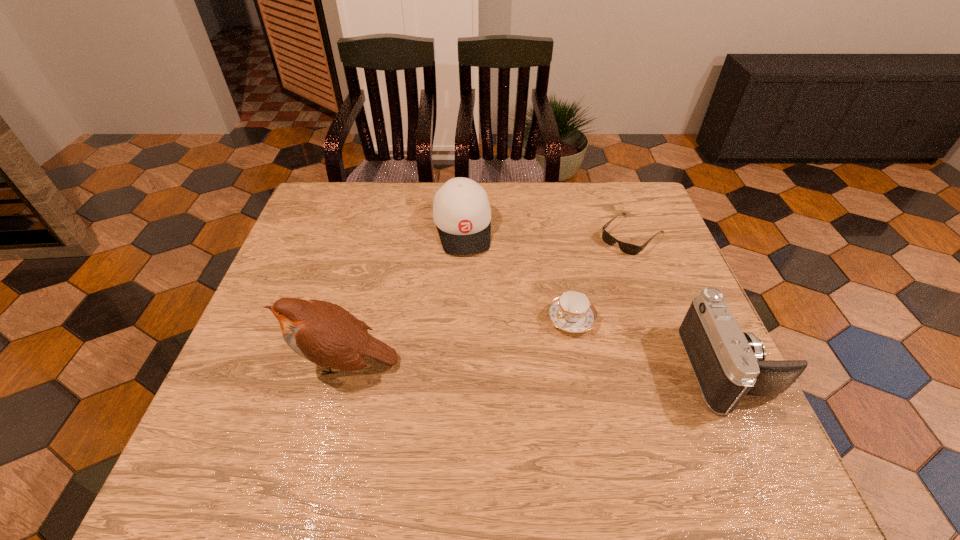
Where is `baseball cap positioned at the far edge`? The height and width of the screenshot is (540, 960). baseball cap positioned at the far edge is located at coordinates (461, 211).

The image size is (960, 540). Identify the location of bird located in the near edge section of the desktop. (324, 333).

The image size is (960, 540). In order to click on camera at the near edge in this screenshot , I will do `click(728, 364)`.

What are the coordinates of `object present at the left edge` in the screenshot? It's located at (324, 333).

The height and width of the screenshot is (540, 960). I want to click on camera that is at the right edge, so click(x=728, y=364).

I want to click on sunglasses that is at the right edge, so click(x=627, y=248).

At what (x,y) coordinates should I click in order to perform the action: click on object located at the near left corner. Please return your answer as a coordinate pair (x, y). This screenshot has height=540, width=960. Looking at the image, I should click on (324, 333).

Identify the location of object that is at the far right corner. This screenshot has width=960, height=540. pos(627,248).

Identify the location of object present at the near right corner. The image size is (960, 540). (728, 364).

Where is `vacant region at the far edge of the desktop`? Image resolution: width=960 pixels, height=540 pixels. vacant region at the far edge of the desktop is located at coordinates (526, 223).